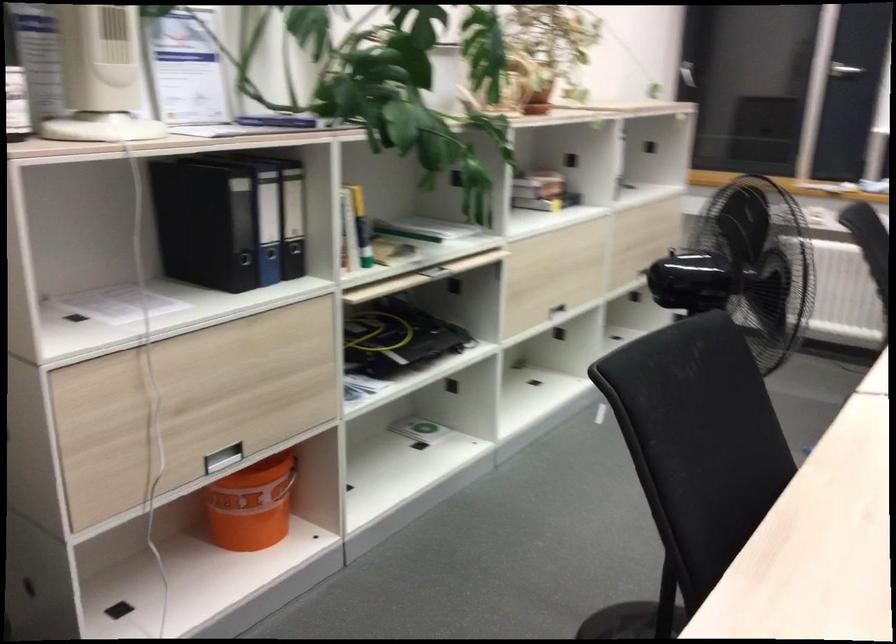
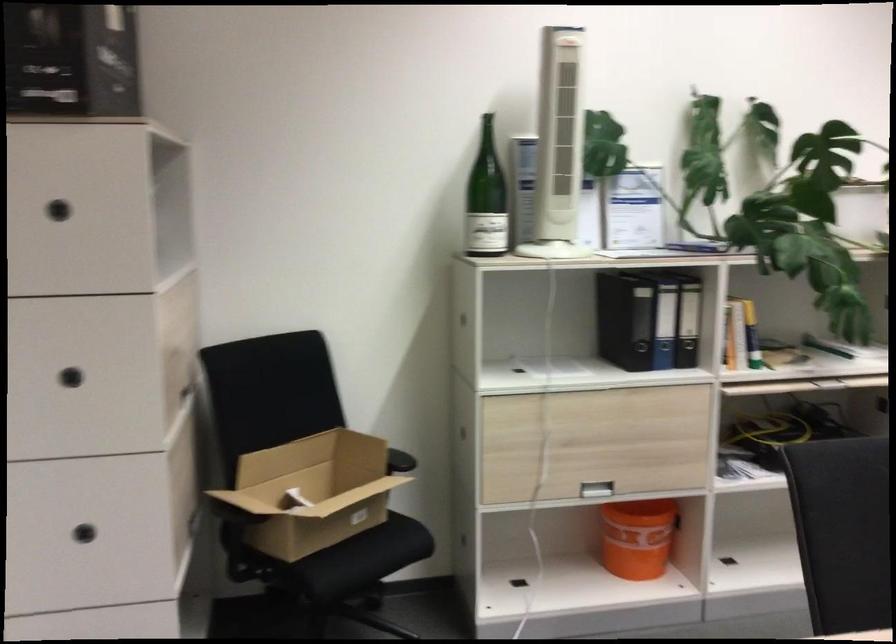
Locate, in the second image, the point that corresponds to the point at 269,500 in the first image.

(636, 538)